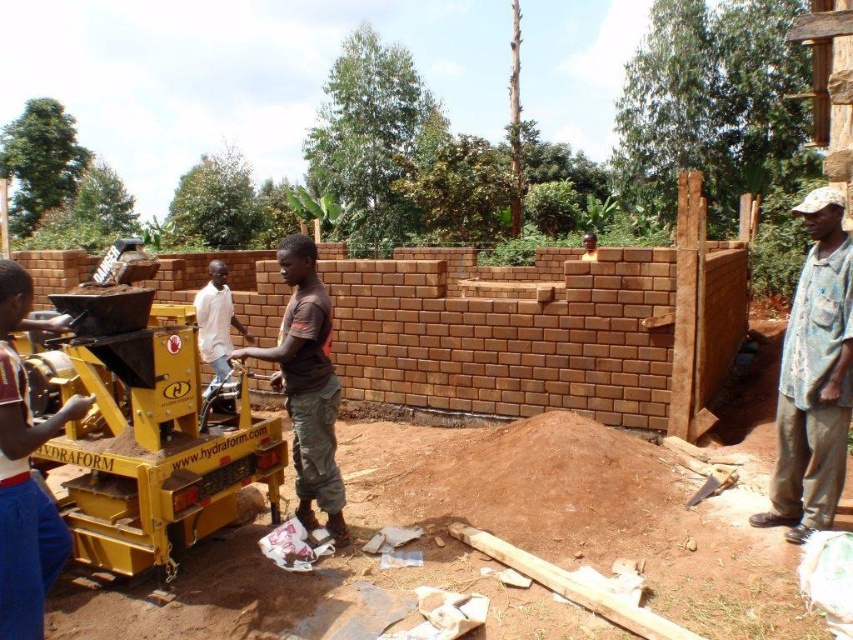
You are standing at the HYDRAFORM machine and want to walk to the point marked as point (201, 339). Which direction should you walk relative to the point marked as point (61, 522)?

You should walk towards the point marked as point (61, 522) because it is in front of point (201, 339), so moving toward it will lead you closer to your destination.

You are a construction worker standing at the HYDRAFORM machine and need to reach a tool located at point (22, 424) and another tool at point (296, 424). Which tool will you reach first if you move straight forward from your current position?

You will reach the tool at point (22, 424) first because it is in front of point (296, 424) from your current position at the HYDRAFORM machine.